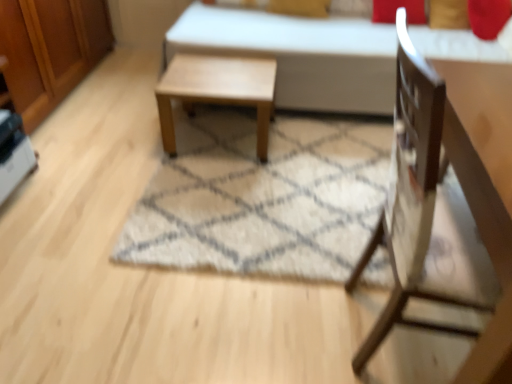
The width and height of the screenshot is (512, 384). I want to click on spots to the right of light brown wooden table at center, so click(318, 151).